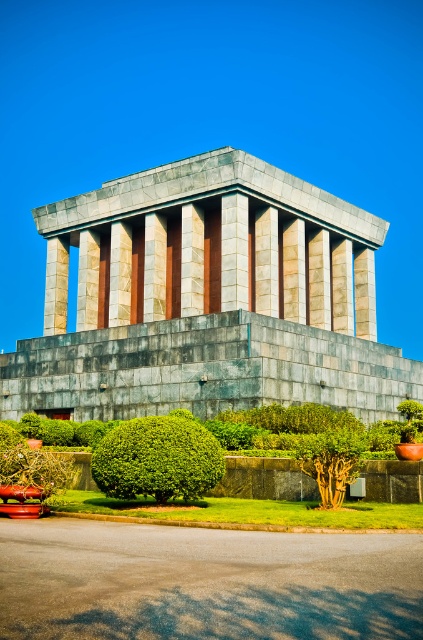
Who is lower down, gray stone temple at center or green leafy bush at center?

green leafy bush at center is below.

Who is more distant from viewer, (291, 349) or (167, 492)?

Point (291, 349)

Identify the location of gray stone temple at center. (208, 298).

Find the location of a particular element. This screenshot has height=640, width=423. gray stone temple at center is located at coordinates (208, 298).

Is gray stone temple at center smaller than green leafy tree at center?

Incorrect, gray stone temple at center is not smaller in size than green leafy tree at center.

Which is more to the left, gray stone temple at center or green leafy tree at center?

Positioned to the left is gray stone temple at center.

This screenshot has height=640, width=423. I want to click on gray stone temple at center, so click(x=208, y=298).

From the picture: Between green leafy bush at center and green leafy tree at center, which one is positioned lower?

green leafy tree at center is below.

Who is higher up, green leafy bush at center or green leafy tree at center?

green leafy bush at center

The image size is (423, 640). I want to click on green leafy bush at center, so click(158, 458).

You are a GUI agent. You are given a task and a screenshot of the screen. Output one action in this format:
    pyautogui.click(x=<x>, y=<y>)
    Task: Click on the green leafy bush at center
    
    Given the screenshot: What is the action you would take?
    pyautogui.click(x=158, y=458)